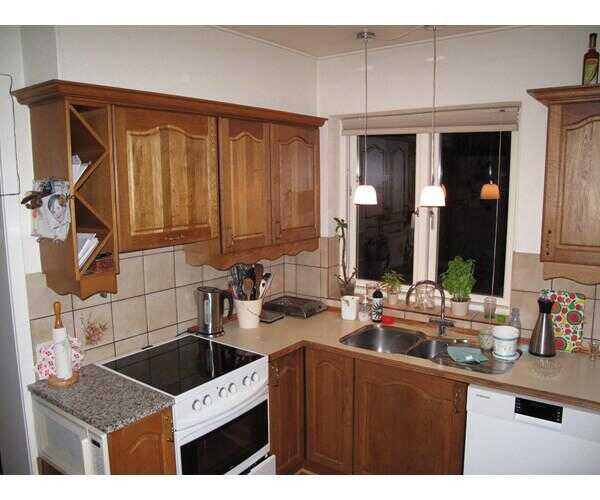
You are a GUI agent. You are given a task and a screenshot of the screen. Output one action in this format:
    pyautogui.click(x=<x>, y=<y>)
    Task: Click on the white walls
    The width and height of the screenshot is (600, 500).
    Given the screenshot: What is the action you would take?
    pyautogui.click(x=331, y=151)